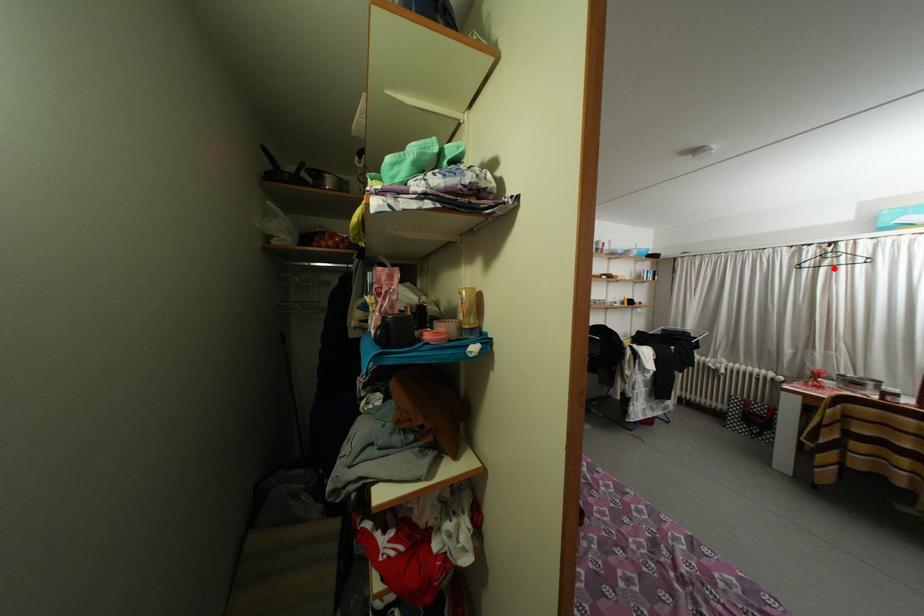
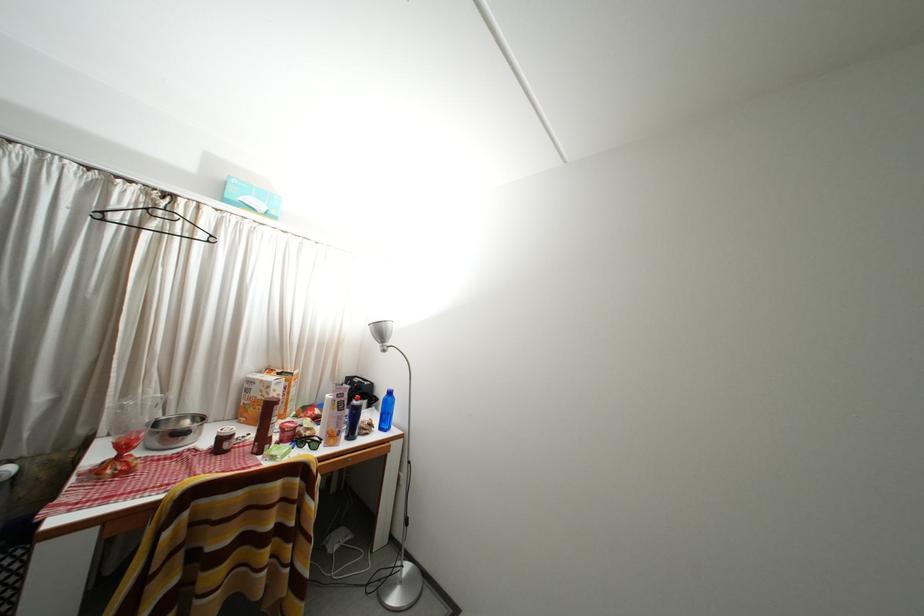
Find the pixel in the second image that matches the highlighted location in the first image.

(161, 230)